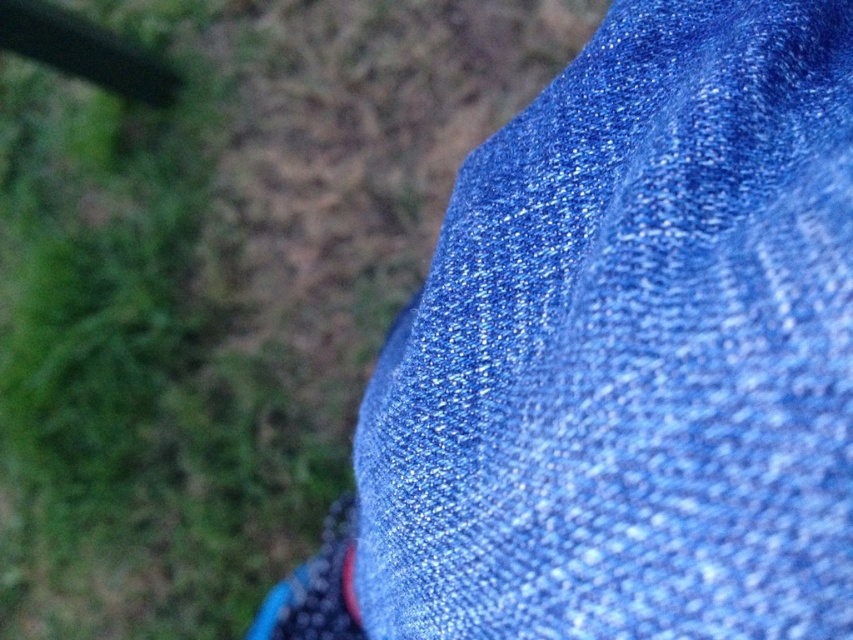
Question: Does blue textured fabric at upper right come in front of blue glittery fabric at upper right?

Choices:
 (A) yes
 (B) no

Answer: (A)

Question: Can you confirm if blue textured fabric at upper right is thinner than blue glittery fabric at upper right?

Choices:
 (A) no
 (B) yes

Answer: (B)

Question: Which point is farther from the camera taking this photo?

Choices:
 (A) (469, 397)
 (B) (276, 381)

Answer: (B)

Question: Does blue textured fabric at upper right appear on the right side of blue glittery fabric at upper right?

Choices:
 (A) no
 (B) yes

Answer: (B)